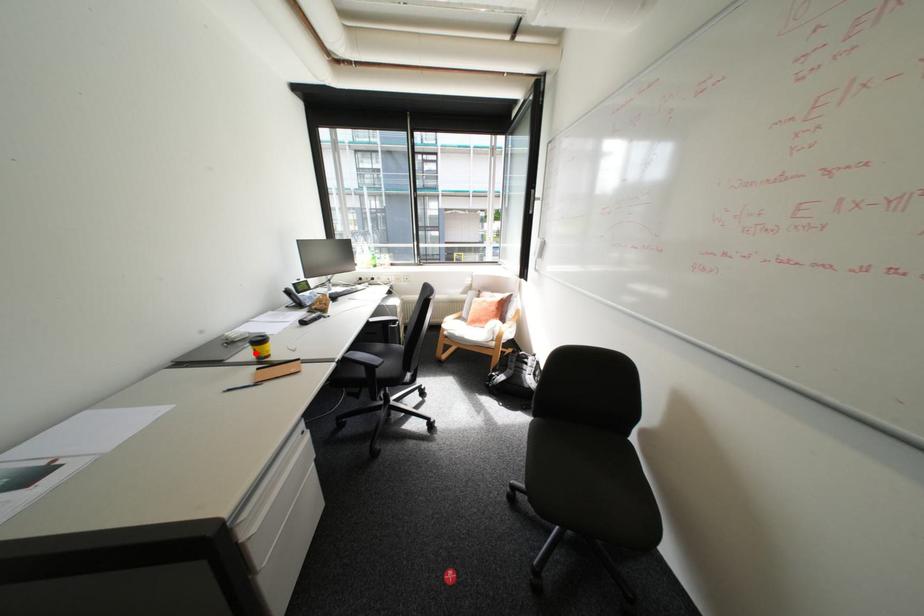
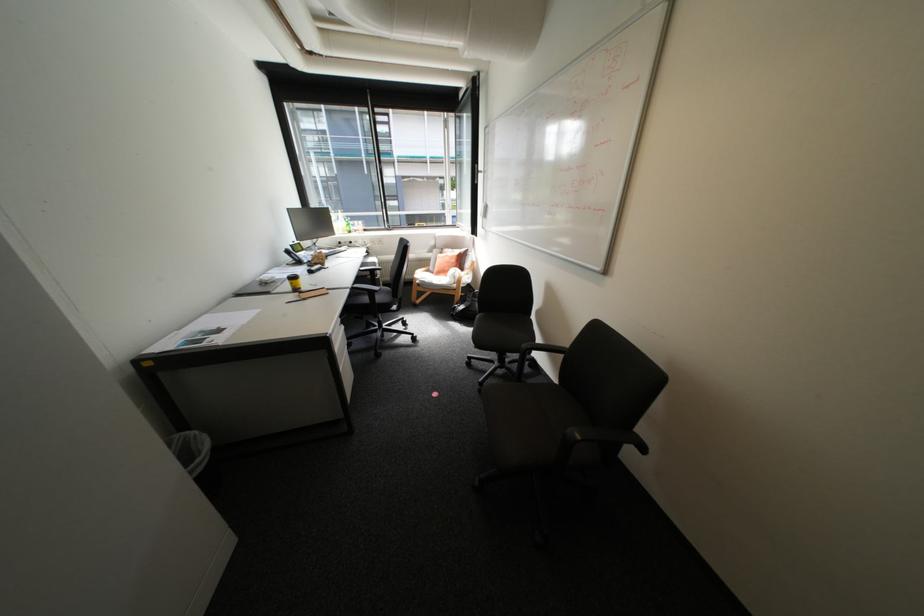
Find the pixel in the second image that matches the highlighted location in the first image.

(296, 286)